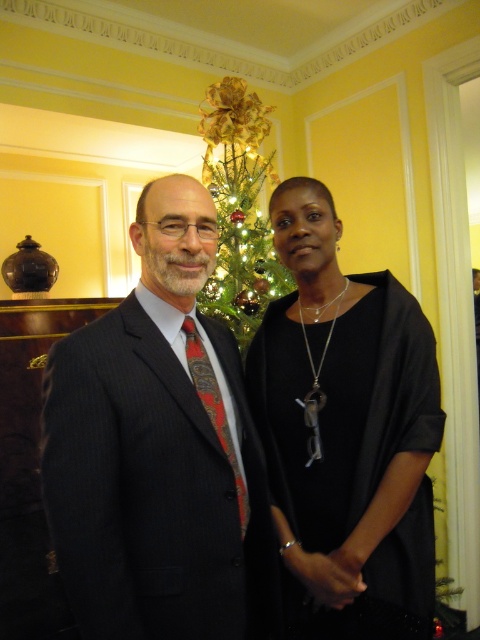
You are a photographer setting up for a group photo. You need to ensure that both the dark pinstripe suit at center and the black matte dress at center are visible in the frame. Based on their positions, which one should you focus on first to ensure proper alignment?

The dark pinstripe suit at center is located below the black matte dress at center, so you should focus on the black matte dress at center first to ensure it stays in frame while adjusting for the lower positioned dark pinstripe suit at center.

You are planning to rent a costume for a party and see both the dark pinstripe suit at center and the black matte dress at center in the image. Which one requires a larger size according to the image?

The dark pinstripe suit at center is larger in size than the black matte dress at center, so the dark pinstripe suit at center requires a larger size.

In the scene shown: You are planning to take a photo of the dark pinstripe suit at center and the green shiny christmas tree at center. Which object should be placed closer to the camera to ensure both fit in the frame?

The dark pinstripe suit at center might be wider than green shiny christmas tree at center, so to ensure both fit in the frame, the green shiny christmas tree at center should be placed closer to the camera.